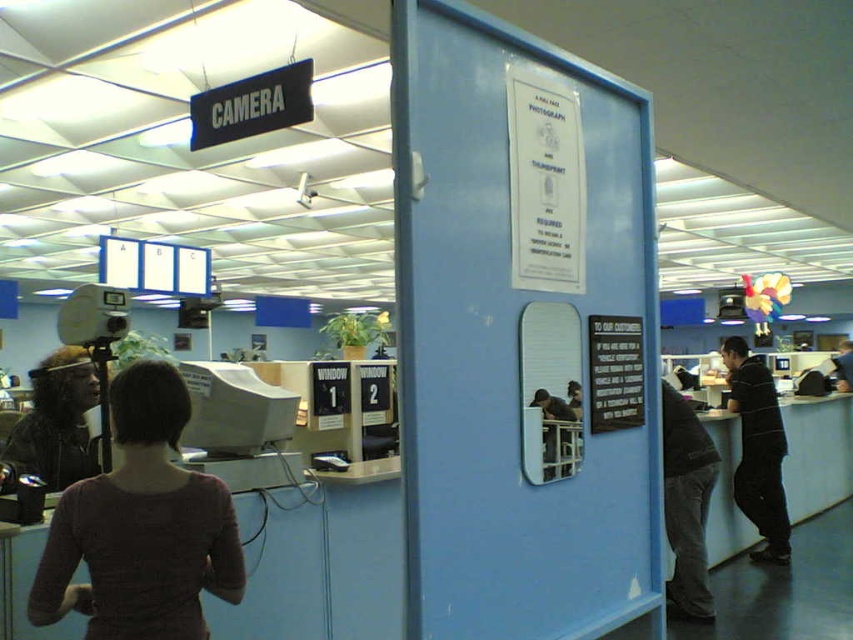
You are standing in the office and need to locate the dark purple sweater at center. According to the coordinates given, where should you look?

The dark purple sweater at center is located at point (x=141, y=525).

You are a person who is 1.7 meters tall and standing at the center of the office. You see the dark purple sweater at center and the camera. Which object is closer to you?

The dark purple sweater at center is closer to you than the camera since they are 1.48 meters apart.